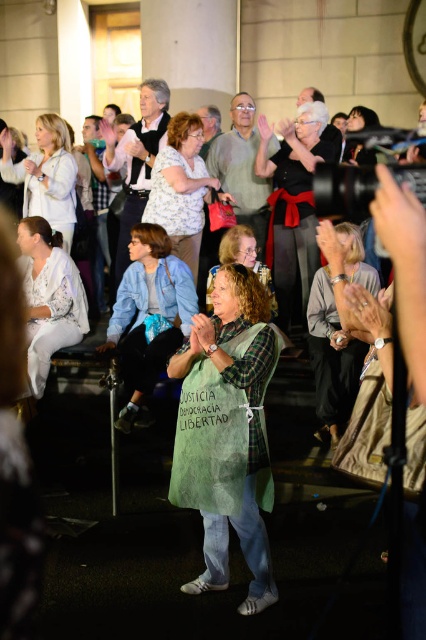
Question: Does light brown leather jacket at upper center have a lesser width compared to matte black camera at upper right?

Choices:
 (A) yes
 (B) no

Answer: (B)

Question: Which object is the closest to the black fabric dress at center?

Choices:
 (A) curly-haired woman at center
 (B) matte gray shirt at upper center
 (C) matte black camera at upper right
 (D) matte pink purse at center

Answer: (A)

Question: Is black fabric dress at center further to the viewer compared to light brown leather jacket at upper center?

Choices:
 (A) no
 (B) yes

Answer: (A)

Question: Which of these objects is positioned closest to the black fabric dress at center?

Choices:
 (A) denim jacket at center
 (B) matte gray shirt at upper center
 (C) white fabric at left
 (D) matte white blouse at upper left

Answer: (A)

Question: Is denim jacket at center closer to camera compared to gray fabric scarf at center?

Choices:
 (A) no
 (B) yes

Answer: (A)

Question: Which point is farther from the camera taking this photo?

Choices:
 (A) (282, 196)
 (B) (69, 284)

Answer: (A)